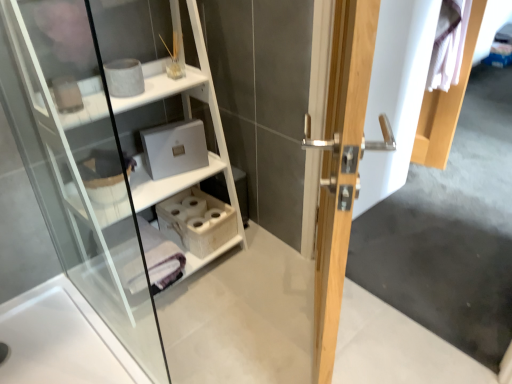
Question: Is wooden tissue box at lower center closer to the viewer compared to light wood door handle at center?

Choices:
 (A) no
 (B) yes

Answer: (A)

Question: Is light wood door handle at center at the back of wooden tissue box at lower center?

Choices:
 (A) yes
 (B) no

Answer: (B)

Question: Is wooden tissue box at lower center further to camera compared to light wood door handle at center?

Choices:
 (A) no
 (B) yes

Answer: (B)

Question: Can you confirm if wooden tissue box at lower center is taller than light wood door handle at center?

Choices:
 (A) yes
 (B) no

Answer: (B)

Question: From the image's perspective, does wooden tissue box at lower center appear lower than light wood door handle at center?

Choices:
 (A) yes
 (B) no

Answer: (A)

Question: In terms of width, does white wood shelf at upper left look wider or thinner when compared to wooden tissue box at lower center?

Choices:
 (A) wide
 (B) thin

Answer: (A)

Question: From their relative heights in the image, would you say white wood shelf at upper left is taller or shorter than wooden tissue box at lower center?

Choices:
 (A) short
 (B) tall

Answer: (B)

Question: Is white wood shelf at upper left bigger or smaller than wooden tissue box at lower center?

Choices:
 (A) big
 (B) small

Answer: (A)

Question: From the image's perspective, is white wood shelf at upper left located above or below wooden tissue box at lower center?

Choices:
 (A) above
 (B) below

Answer: (A)

Question: From the image's perspective, is light wood door handle at center above or below white wood shelf at upper left?

Choices:
 (A) below
 (B) above

Answer: (A)

Question: Considering the positions of light wood door handle at center and white wood shelf at upper left in the image, is light wood door handle at center bigger or smaller than white wood shelf at upper left?

Choices:
 (A) small
 (B) big

Answer: (A)

Question: Is light wood door handle at center in front of or behind white wood shelf at upper left in the image?

Choices:
 (A) behind
 (B) front

Answer: (B)

Question: In terms of width, does light wood door handle at center look wider or thinner when compared to white wood shelf at upper left?

Choices:
 (A) thin
 (B) wide

Answer: (A)

Question: Considering the positions of point (176, 365) and point (335, 69), is point (176, 365) closer or farther from the camera than point (335, 69)?

Choices:
 (A) farther
 (B) closer

Answer: (A)

Question: Considering their positions, is white wood shelf at upper left located in front of or behind light wood door handle at center?

Choices:
 (A) behind
 (B) front

Answer: (A)